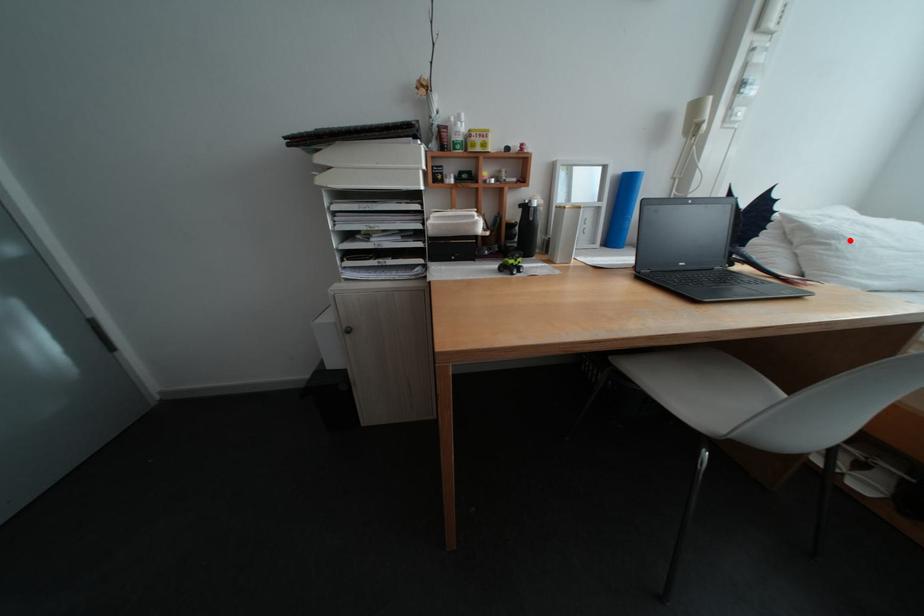
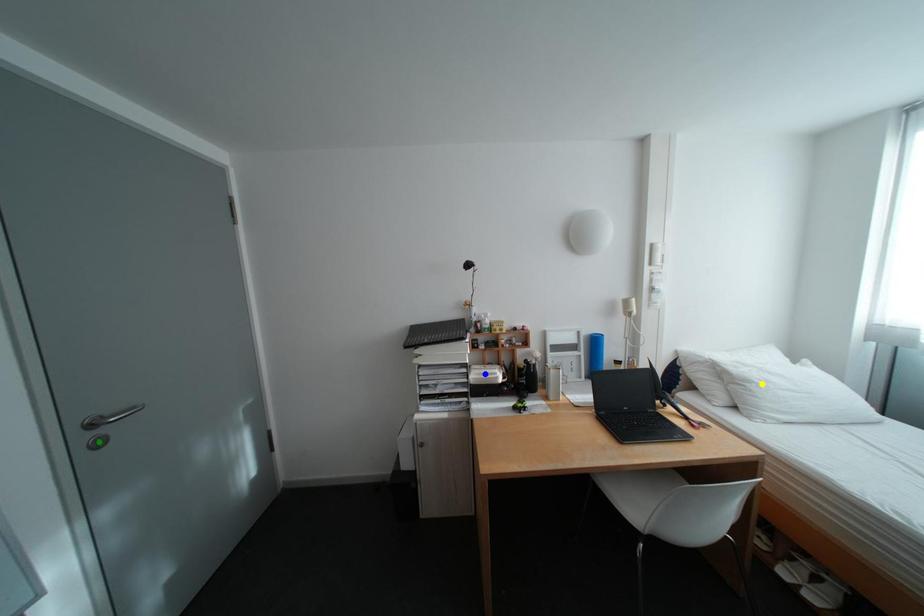
Question: I am providing you with two images of the same scene from different viewpoints. A red point is marked on the first image. You are given multiple points on the second image. Which spot in image 2 lines up with the point in image 1?

Choices:
 (A) blue point
 (B) yellow point
 (C) green point

Answer: (B)